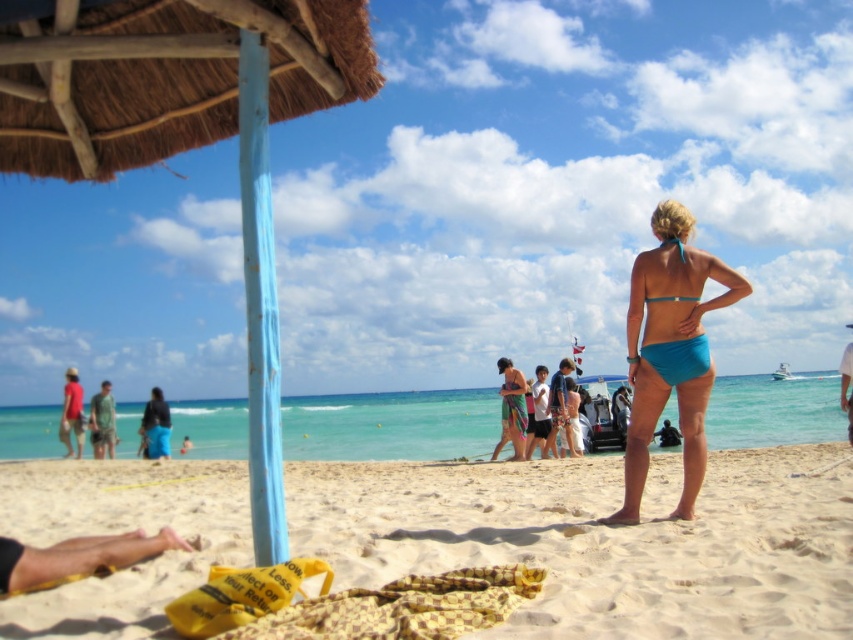
You are standing on the beach looking at the scene. There are two points marked in the image. Which point is closer to you, point (129, 524) or point (543, 392)?

Point (129, 524) is closer to the viewer than point (543, 392).

You are a drone operator trying to capture a photo of the beach scene. You need to ensure that both the point at [462,518] and the point at [80,396] are in focus. Given that your camera can only focus on objects within a 0.1 unit depth range, will both points be in focus?

Point [462,518] is closer to the camera than point [80,396]. The depth difference between them is more than 0.1 units, so only the closer point will be in focus.